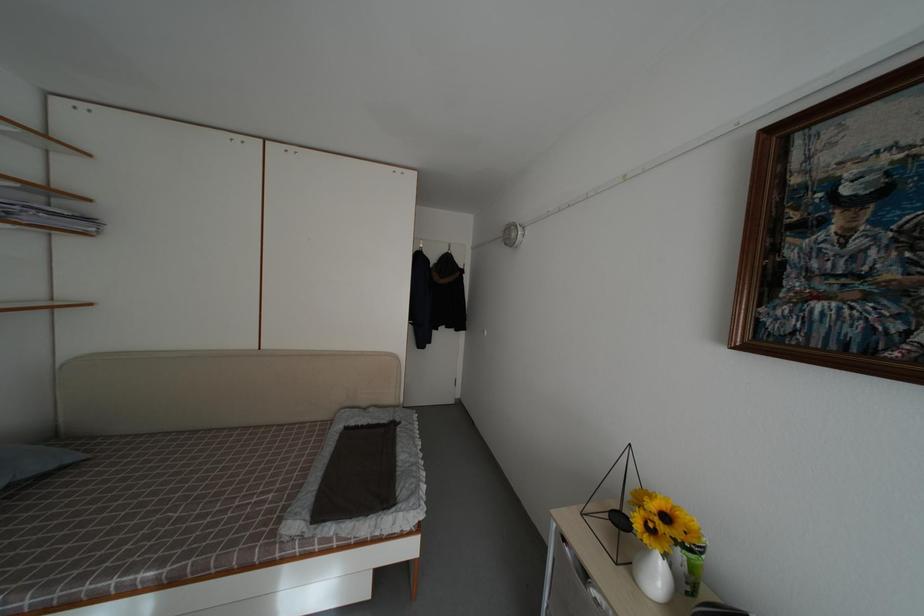
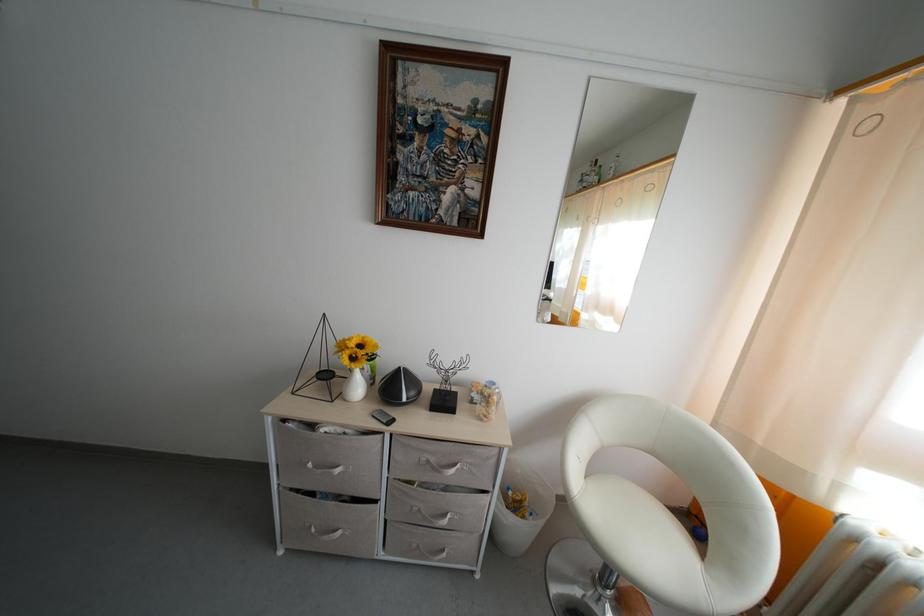
The point at [626,528] is marked in the first image. Where is the corresponding point in the second image?

(332, 382)